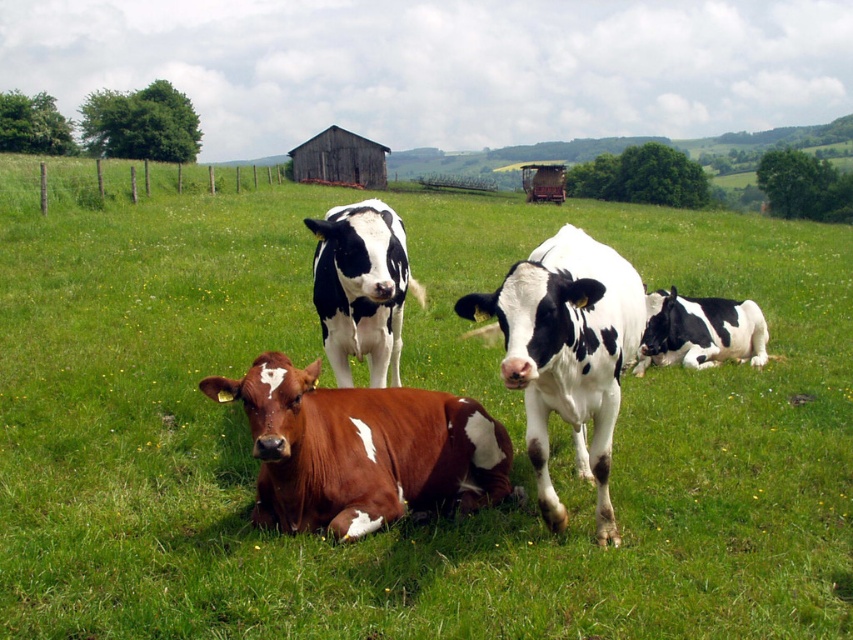
Question: Which of the following is the closest to the observer?

Choices:
 (A) black-and-white spotted cow at center
 (B) brown speckled cow at center
 (C) black and white spotted cow at center
 (D) white-spotted cow at center

Answer: (D)

Question: Is white-spotted fur cow at center below black and white spotted cow at center?

Choices:
 (A) no
 (B) yes

Answer: (A)

Question: Estimate the real-world distances between objects in this image. Which object is closer to the brown speckled cow at center?

Choices:
 (A) white-spotted cow at center
 (B) white-spotted fur cow at center
 (C) black-and-white spotted cow at center

Answer: (A)

Question: Which point is closer to the camera?

Choices:
 (A) white-spotted fur cow at center
 (B) black and white spotted cow at center
 (C) black-and-white spotted cow at center

Answer: (A)

Question: From the image, what is the correct spatial relationship of black and white spotted cow at center in relation to black-and-white spotted cow at center?

Choices:
 (A) left
 (B) right

Answer: (A)

Question: Does black and white spotted cow at center appear under black-and-white spotted cow at center?

Choices:
 (A) no
 (B) yes

Answer: (B)